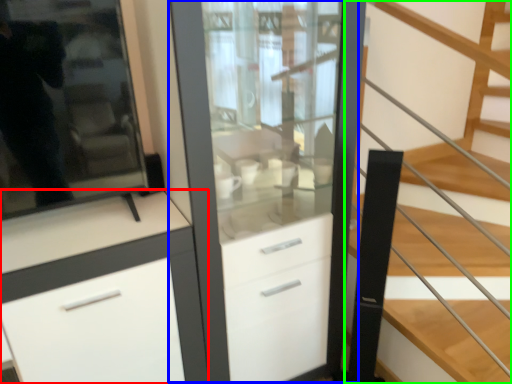
Question: Considering the real-world distances, which object is farthest from cabinetry (highlighted by a red box)? dresser (highlighted by a blue box) or stairs (highlighted by a green box)?

Choices:
 (A) dresser
 (B) stairs

Answer: (B)